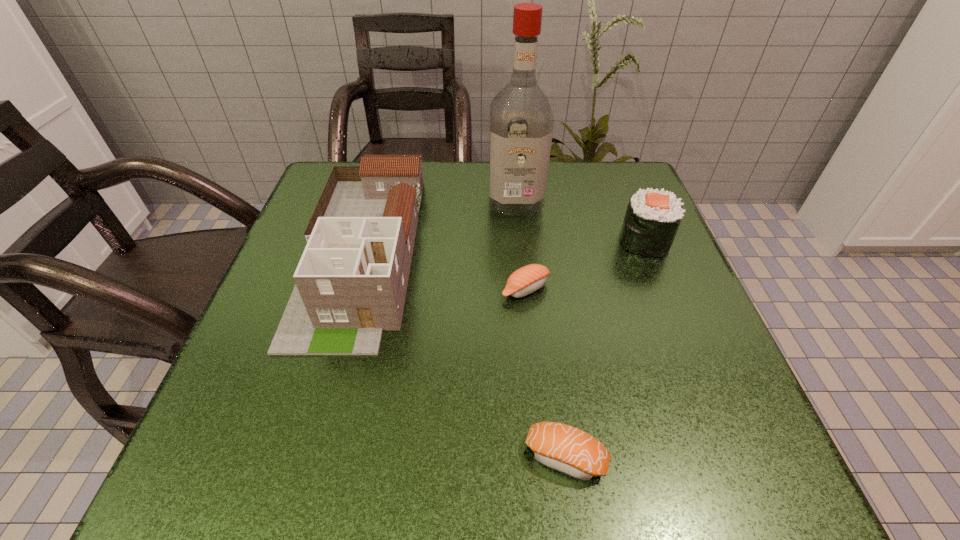
At what (x,y) coordinates should I click in order to perform the action: click on vacant region at the left edge. Please return your answer as a coordinate pair (x, y). The height and width of the screenshot is (540, 960). Looking at the image, I should click on (276, 313).

At what (x,y) coordinates should I click in order to perform the action: click on vacant space at the right edge of the desktop. Please return your answer as a coordinate pair (x, y). The image size is (960, 540). Looking at the image, I should click on [x=728, y=395].

The height and width of the screenshot is (540, 960). In order to click on vacant area at the far left corner in this screenshot , I will do `click(319, 186)`.

At what (x,y) coordinates should I click in order to perform the action: click on vacant area at the far right corner. Please return your answer as a coordinate pair (x, y). Looking at the image, I should click on (587, 163).

Where is `free area in between the nearest object and the second nearest sushi`? The width and height of the screenshot is (960, 540). free area in between the nearest object and the second nearest sushi is located at coordinates (545, 373).

Locate an element on the screen. vacant space that's between the leftmost object and the liquor is located at coordinates (439, 227).

Where is `unoccupied position between the nearest object and the tallest object`? This screenshot has width=960, height=540. unoccupied position between the nearest object and the tallest object is located at coordinates (540, 329).

Find the location of a particular element. The height and width of the screenshot is (540, 960). blank region between the nearest sushi and the second nearest sushi is located at coordinates (545, 373).

The image size is (960, 540). I want to click on vacant area between the nearest object and the dollhouse, so click(464, 354).

I want to click on free space that is in between the nearest object and the second farthest sushi, so click(x=545, y=373).